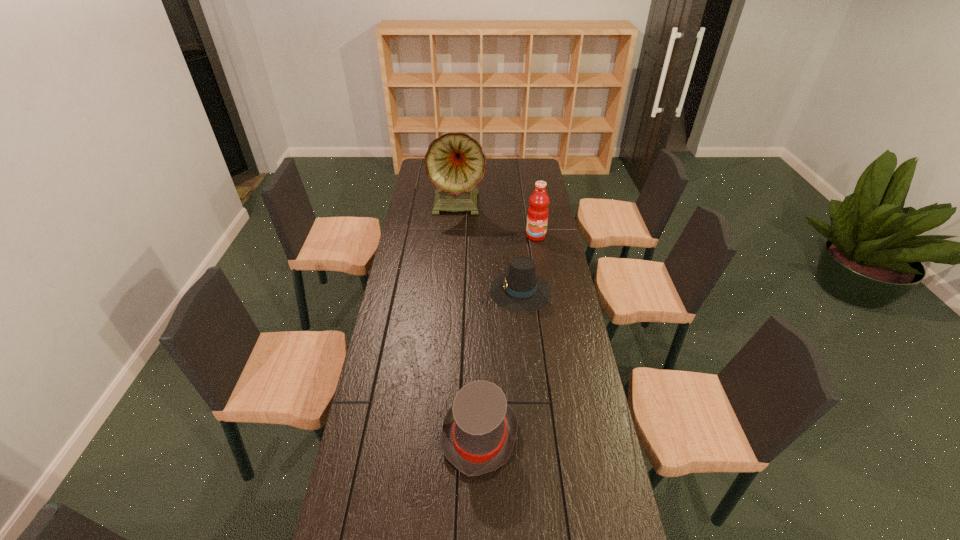
Locate an element on the screen. This screenshot has height=540, width=960. object that stands as the third closest to the nearest object is located at coordinates (455, 163).

Find the location of a particular element. The image size is (960, 540). vacant space that satisfies the following two spatial constraints: 1. from the horn of the nearer hat; 2. on the left side of the farthest object is located at coordinates (443, 435).

I want to click on free space that satisfies the following two spatial constraints: 1. on the front label of the fruit juice; 2. on the front-facing side of the farther hat, so click(544, 291).

Where is `blank space that satisfies the following two spatial constraints: 1. from the horn of the nearest object; 2. on the left side of the farthest object`? The image size is (960, 540). blank space that satisfies the following two spatial constraints: 1. from the horn of the nearest object; 2. on the left side of the farthest object is located at coordinates (443, 435).

Locate an element on the screen. free location that satisfies the following two spatial constraints: 1. from the horn of the nearer hat; 2. on the right side of the tallest object is located at coordinates click(443, 435).